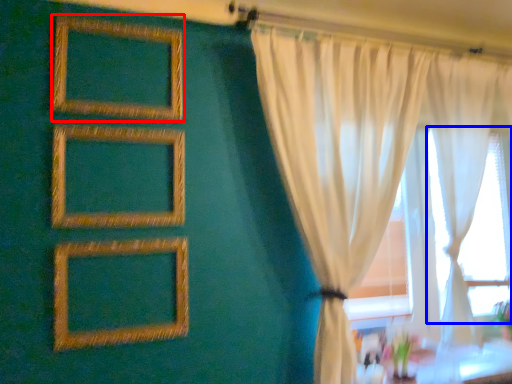
Question: Which object is further to the camera taking this photo, picture frame (highlighted by a red box) or bay window (highlighted by a blue box)?

Choices:
 (A) picture frame
 (B) bay window

Answer: (B)